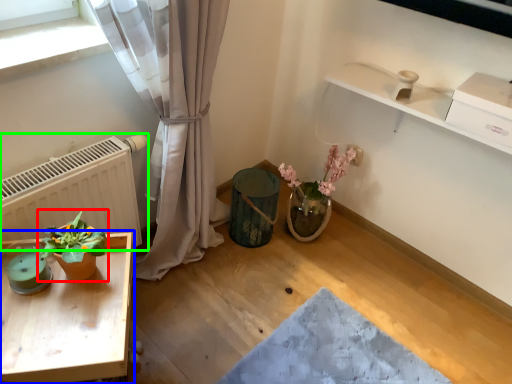
Question: Considering the real-world distances, which object is farthest from houseplant (highlighted by a red box)? table (highlighted by a blue box) or radiator (highlighted by a green box)?

Choices:
 (A) table
 (B) radiator

Answer: (B)